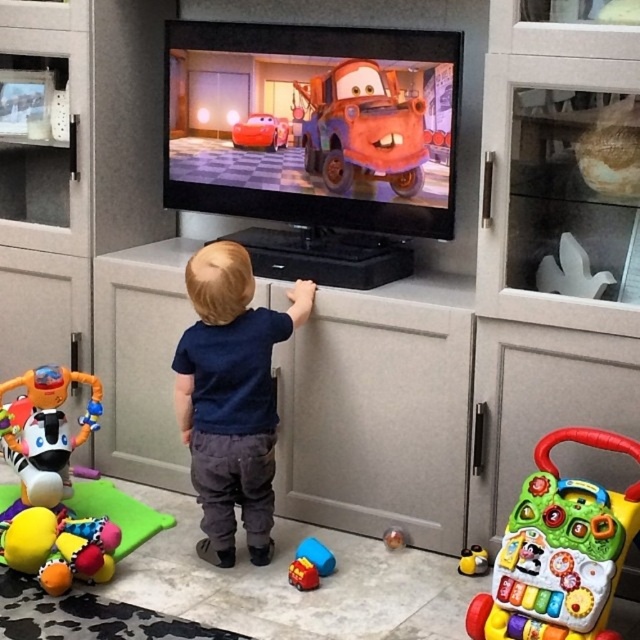
Which is more to the right, multicolored plastic walker at lower right or rubberized plastic toy at lower center?

multicolored plastic walker at lower right is more to the right.

Does multicolored plastic walker at lower right have a larger size compared to rubberized plastic toy at lower center?

Yes, multicolored plastic walker at lower right is bigger than rubberized plastic toy at lower center.

Measure the distance between point (532, 556) and camera.

They are 6.47 feet apart.

Find the location of a particular element. The image size is (640, 640). multicolored plastic walker at lower right is located at coordinates (560, 550).

Which is more to the left, rubberized plastic toy at lower right or rubberized plastic ball at center?

rubberized plastic ball at center is more to the left.

Which is above, rubberized plastic toy at lower right or rubberized plastic ball at center?

rubberized plastic ball at center is higher up.

This screenshot has width=640, height=640. What do you see at coordinates (474, 561) in the screenshot?
I see `rubberized plastic toy at lower right` at bounding box center [474, 561].

This screenshot has height=640, width=640. Identify the location of rubberized plastic toy at lower right. (474, 561).

Is point (304, 560) less distant than point (484, 564)?

Yes, point (304, 560) is in front of point (484, 564).

Is rubberized plastic toy at lower center shorter than rubberized plastic toy at lower right?

In fact, rubberized plastic toy at lower center may be taller than rubberized plastic toy at lower right.

From the picture: Who is more distant from viewer, (312, 586) or (472, 550)?

The point (472, 550) is behind.

This screenshot has width=640, height=640. In order to click on rubberized plastic toy at lower center in this screenshot , I will do `click(308, 564)`.